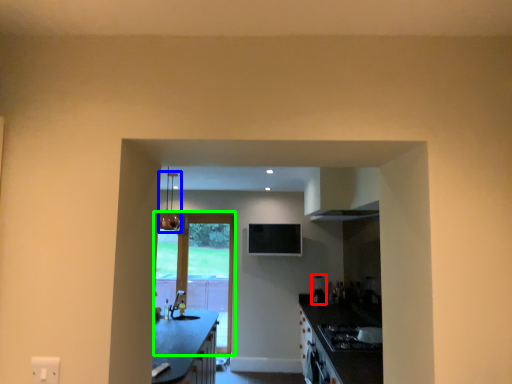
Question: Based on their relative distances, which object is farther from appliance (highlighted by a red box)? Choose from light fixture (highlighted by a blue box) and door (highlighted by a green box).

Choices:
 (A) light fixture
 (B) door

Answer: (A)